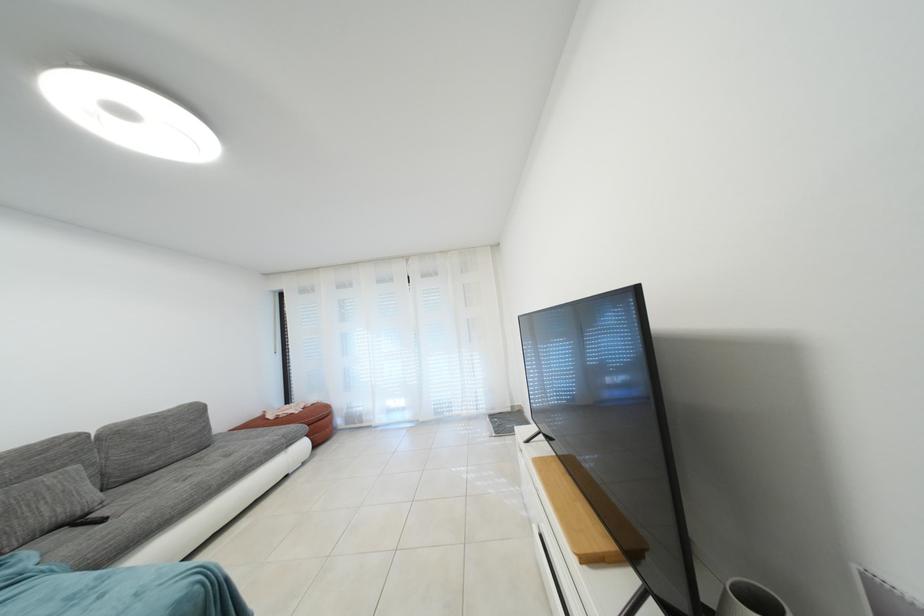
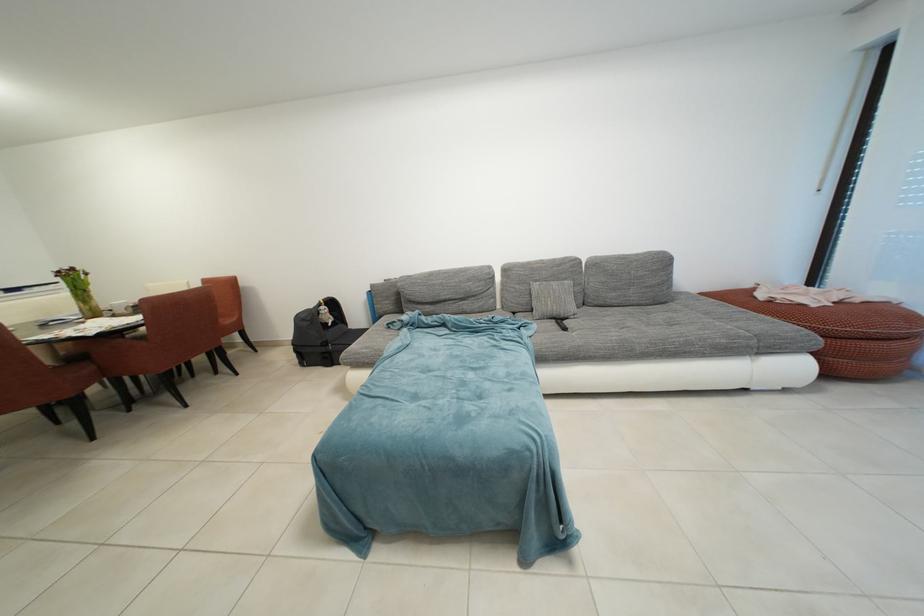
In the second image, find the point that corresponds to (71,537) in the first image.

(560, 328)